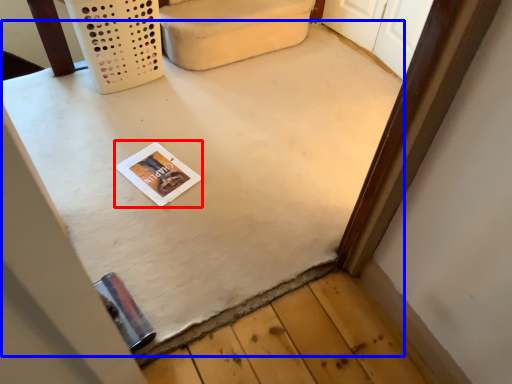
Question: Which object is closer to the camera taking this photo, magazine (highlighted by a red box) or table (highlighted by a blue box)?

Choices:
 (A) magazine
 (B) table

Answer: (B)